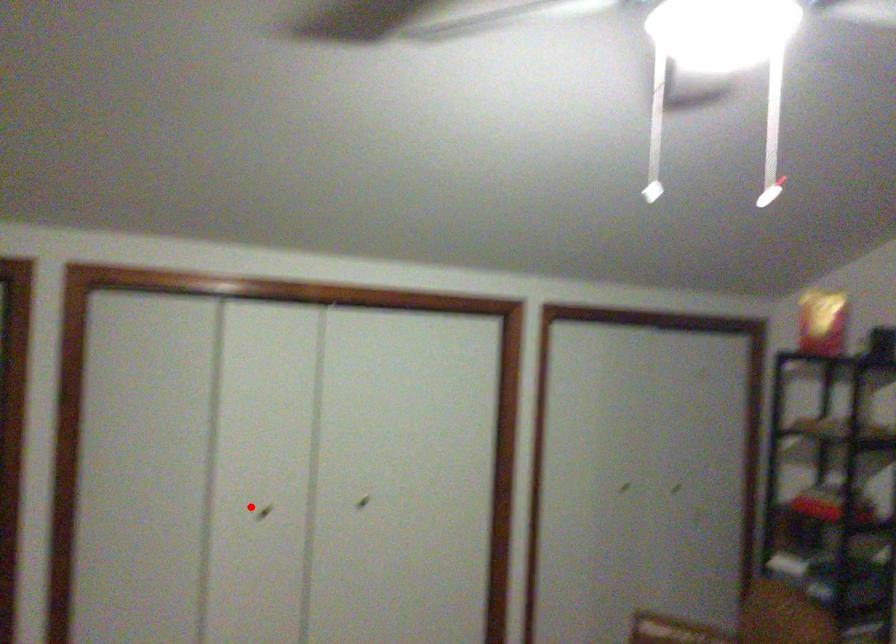
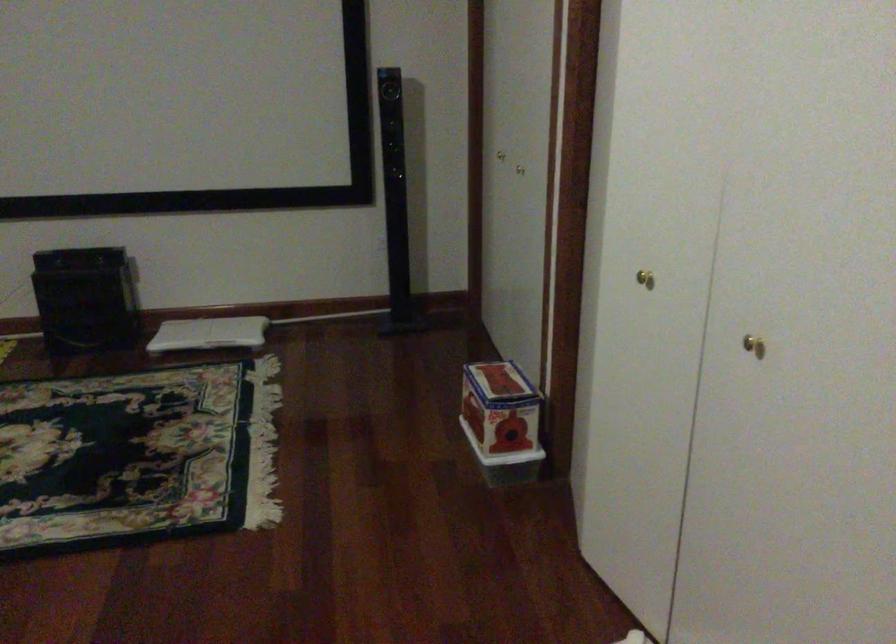
Question: I am providing you with two images of the same scene from different viewpoints. A red point is marked on the first image. Is the red point's position out of view in image 2?

Choices:
 (A) Yes
 (B) No

Answer: (B)